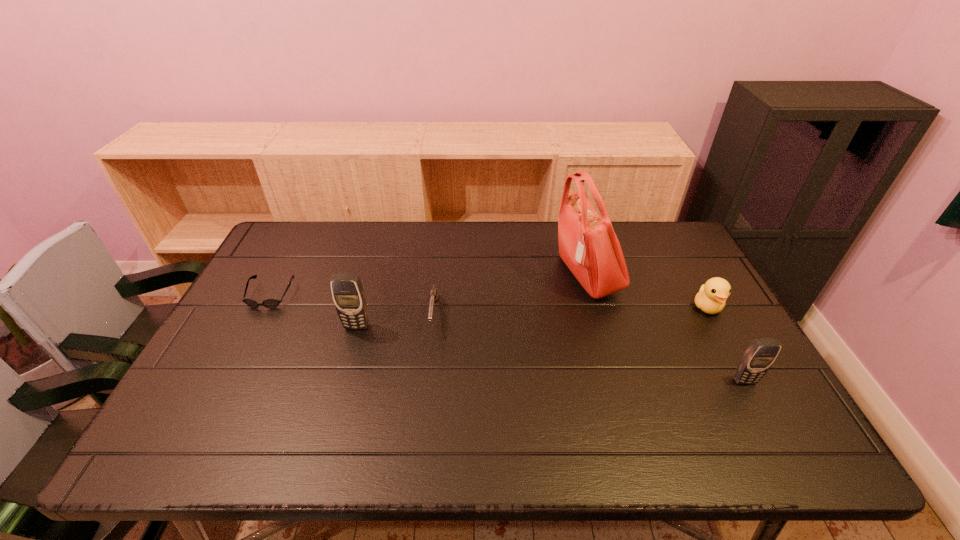
This screenshot has width=960, height=540. Find the location of `the second object from left to right`. the second object from left to right is located at coordinates (348, 294).

The width and height of the screenshot is (960, 540). What are the coordinates of `the second tallest object` in the screenshot? It's located at (348, 294).

The width and height of the screenshot is (960, 540). Find the location of `the nearest object`. the nearest object is located at coordinates click(x=758, y=358).

Where is `the shorter cellular telephone`? This screenshot has width=960, height=540. the shorter cellular telephone is located at coordinates (758, 358).

Image resolution: width=960 pixels, height=540 pixels. In order to click on handbag in this screenshot , I will do `click(588, 245)`.

Where is `the tallest object`? the tallest object is located at coordinates (588, 245).

The image size is (960, 540). In order to click on the fifth tallest object in this screenshot , I will do `click(434, 296)`.

At what (x,y) coordinates should I click in order to perform the action: click on gun. Please return your answer as a coordinate pair (x, y). The height and width of the screenshot is (540, 960). Looking at the image, I should click on (434, 296).

Locate an element on the screen. The height and width of the screenshot is (540, 960). sunglasses is located at coordinates (268, 303).

I want to click on the leftmost object, so (268, 303).